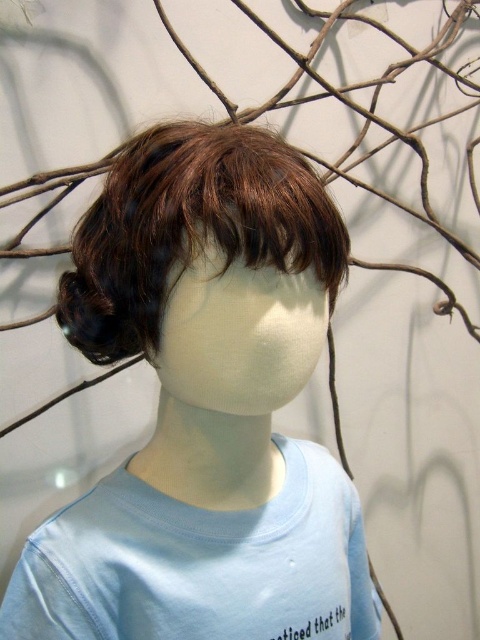
You are a photographer standing at a certain distance from the mannequin head. You want to take a closeup shot of the point labeled as point (325, 234). If your camera requires you to be within 15 inches to capture clear details, will you need to move closer or farther away?

The distance between point (325, 234) and the camera is 15.66 inches. Since this is more than 15 inches, you need to move closer to ensure the camera can capture clear details.